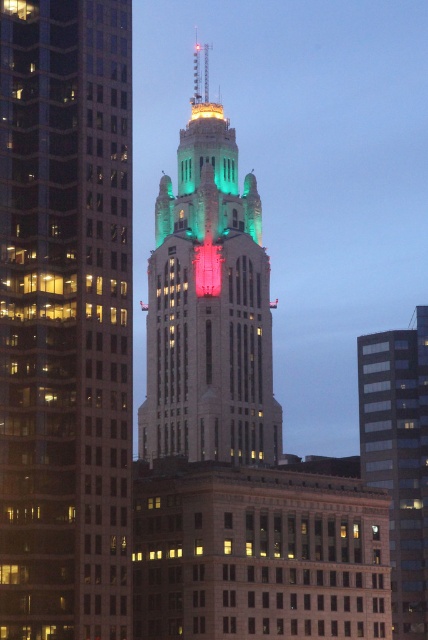
Is green stone tower at center shorter than glassy reflective skyscraper at center?

No, green stone tower at center is not shorter than glassy reflective skyscraper at center.

Is green stone tower at center closer to camera compared to glassy reflective skyscraper at center?

No, green stone tower at center is behind glassy reflective skyscraper at center.

You are a GUI agent. You are given a task and a screenshot of the screen. Output one action in this format:
    pyautogui.click(x=<x>, y=<y>)
    Task: Click on the green stone tower at center
    Image resolution: width=428 pixels, height=640 pixels.
    Given the screenshot: What is the action you would take?
    pyautogui.click(x=208, y=305)

Between green glass skyscraper at center and green stone tower at center, which one appears on the right side from the viewer's perspective?

Positioned to the right is green stone tower at center.

Is green glass skyscraper at center further to the viewer compared to green stone tower at center?

No.

Between point (64, 320) and point (186, 166), which one is positioned behind?

Positioned behind is point (186, 166).

Identify the location of green glass skyscraper at center. This screenshot has height=640, width=428. (65, 317).

Does green glass skyscraper at center appear over glassy reflective skyscraper at center?

Correct, green glass skyscraper at center is located above glassy reflective skyscraper at center.

Can you confirm if green glass skyscraper at center is positioned to the left of glassy reflective skyscraper at center?

Correct, you'll find green glass skyscraper at center to the left of glassy reflective skyscraper at center.

Measure the distance between green glass skyscraper at center and camera.

They are 74.82 meters apart.

Identify the location of green glass skyscraper at center. (65, 317).